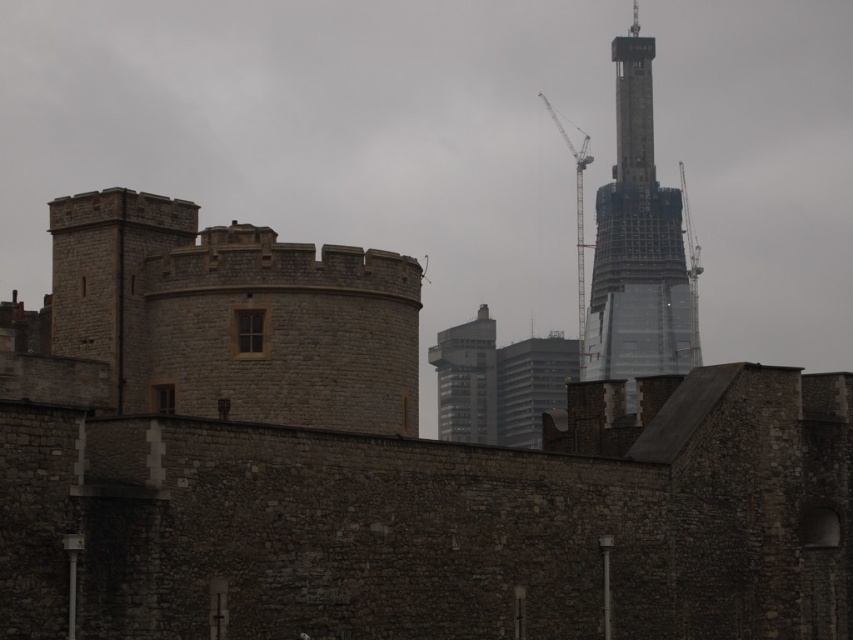
Question: Which of the following is the closest to the observer?

Choices:
 (A) metallic gray crane at upper right
 (B) transparent glass tower at upper right
 (C) glassy reflective skyscraper at center
 (D) stone wall at center

Answer: (D)

Question: Estimate the real-world distances between objects in this image. Which object is closer to the metallic gray crane at upper right?

Choices:
 (A) glassy reflective skyscraper at center
 (B) stone wall at center
 (C) transparent glass tower at upper right

Answer: (C)

Question: Can you confirm if glassy reflective skyscraper at center is positioned below metallic gray crane at upper right?

Choices:
 (A) no
 (B) yes

Answer: (B)

Question: Which object is farther from the camera taking this photo?

Choices:
 (A) glassy reflective skyscraper at center
 (B) transparent glass tower at upper right
 (C) metallic gray crane at upper right

Answer: (A)

Question: Does stone wall at center appear under metallic gray crane at upper right?

Choices:
 (A) no
 (B) yes

Answer: (B)

Question: Does stone wall at center have a greater width compared to glassy reflective skyscraper at center?

Choices:
 (A) no
 (B) yes

Answer: (B)